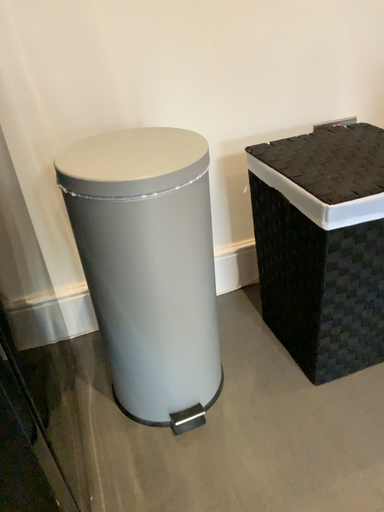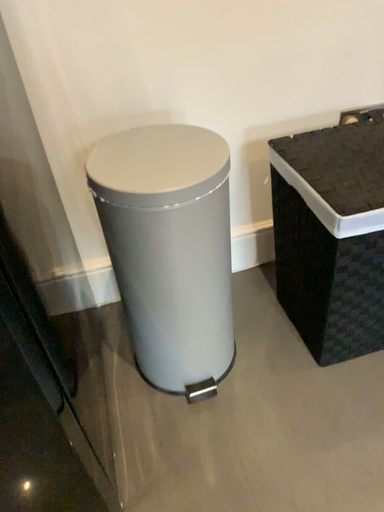
Question: Which way did the camera rotate in the video?

Choices:
 (A) rotated downward
 (B) rotated upward

Answer: (A)